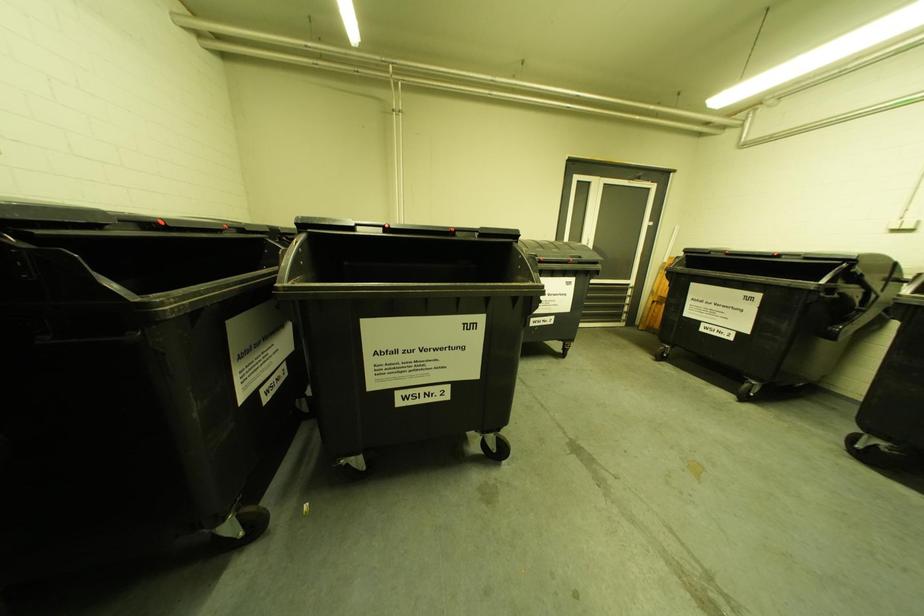
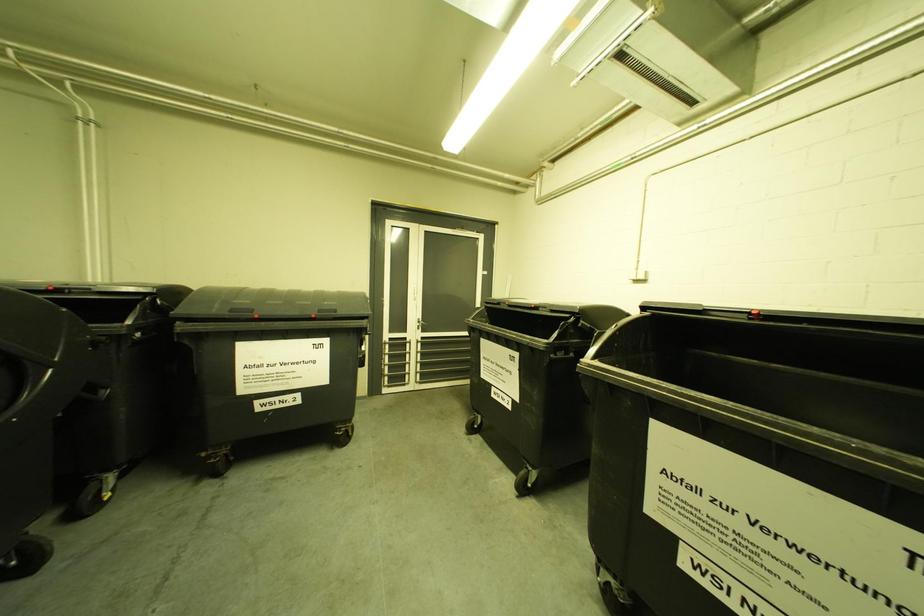
Question: The images are taken continuously from a first-person perspective. In which direction are you moving?

Choices:
 (A) Left
 (B) Right
 (C) Forward
 (D) Backward

Answer: (B)